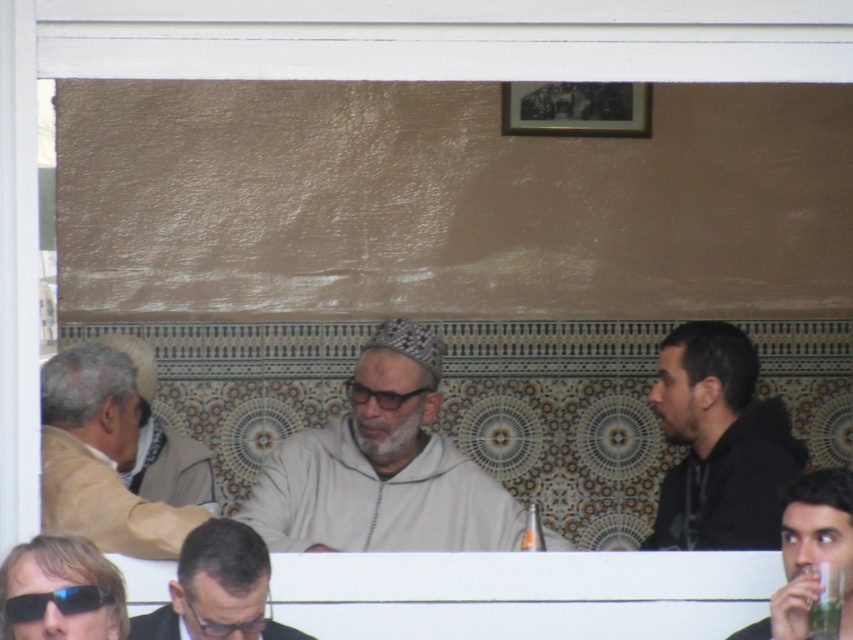
Question: Which of the following is the closest to the observer?

Choices:
 (A) (86, 544)
 (B) (183, 618)
 (C) (80, 605)

Answer: (C)

Question: Among these objects, which one is farthest from the camera?

Choices:
 (A) matte black goggles at lower center
 (B) light beige jacket at left
 (C) matte black sunglasses at lower left
 (D) dark brown hair at lower center

Answer: (B)

Question: Which object appears closest to the camera in this image?

Choices:
 (A) matte black sunglasses at lower left
 (B) light beige jacket at left
 (C) black matte shirt at right

Answer: (A)

Question: Can you confirm if black matte shirt at right is positioned below matte black sunglasses at lower left?

Choices:
 (A) yes
 (B) no

Answer: (B)

Question: Is matte black sunglasses at lower left positioned at the back of matte black cup at lower right?

Choices:
 (A) yes
 (B) no

Answer: (B)

Question: Does white matte cap at center appear on the left side of matte black goggles at lower center?

Choices:
 (A) yes
 (B) no

Answer: (B)